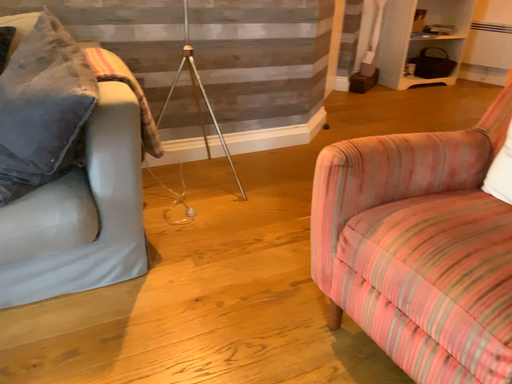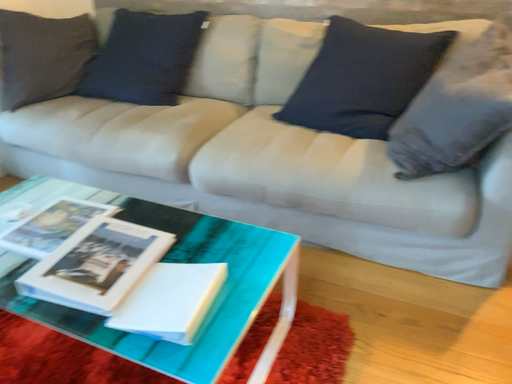
Question: Which way did the camera rotate in the video?

Choices:
 (A) rotated upward
 (B) rotated downward

Answer: (A)